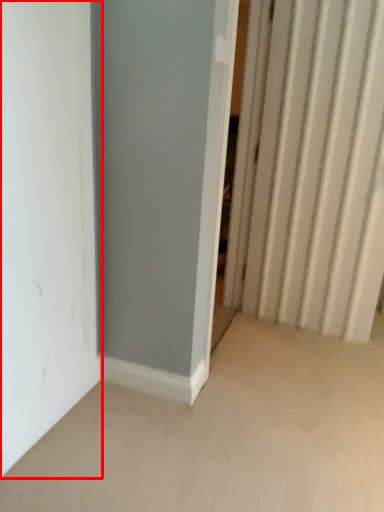
Question: From the image's perspective, where is door (annotated by the red box) located in relation to radiator in the image?

Choices:
 (A) above
 (B) below

Answer: (B)